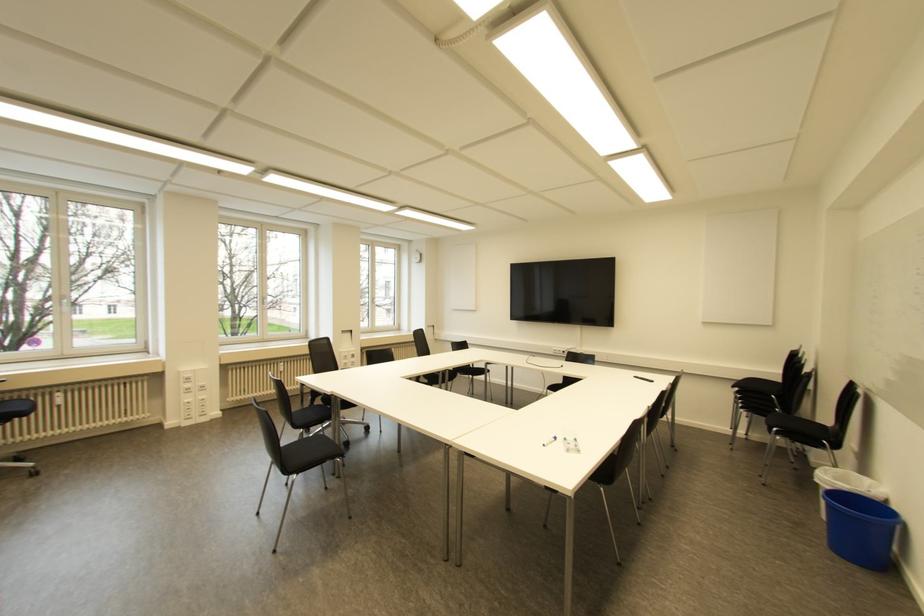
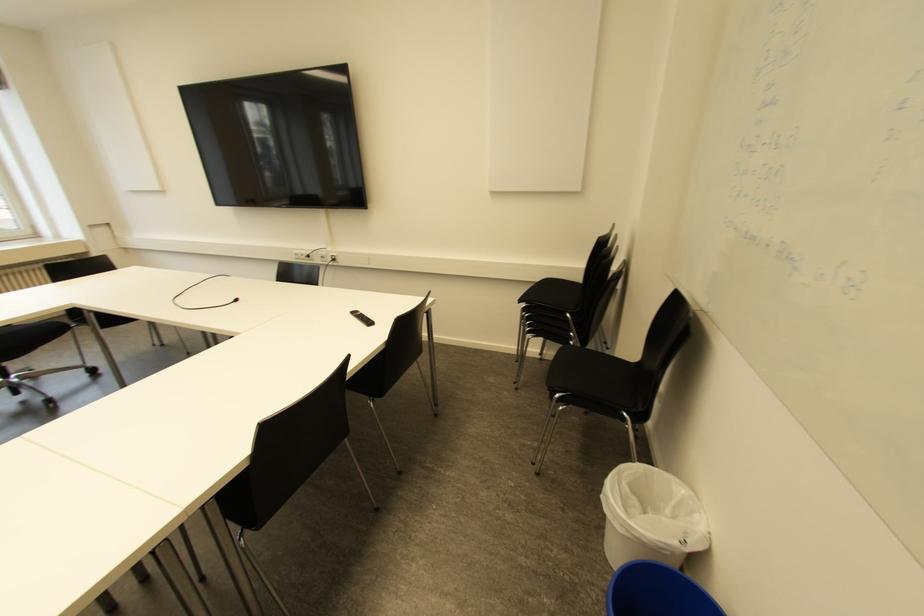
What movement of the cameraman would produce the second image?

The movement direction of the cameraman is right, forward.